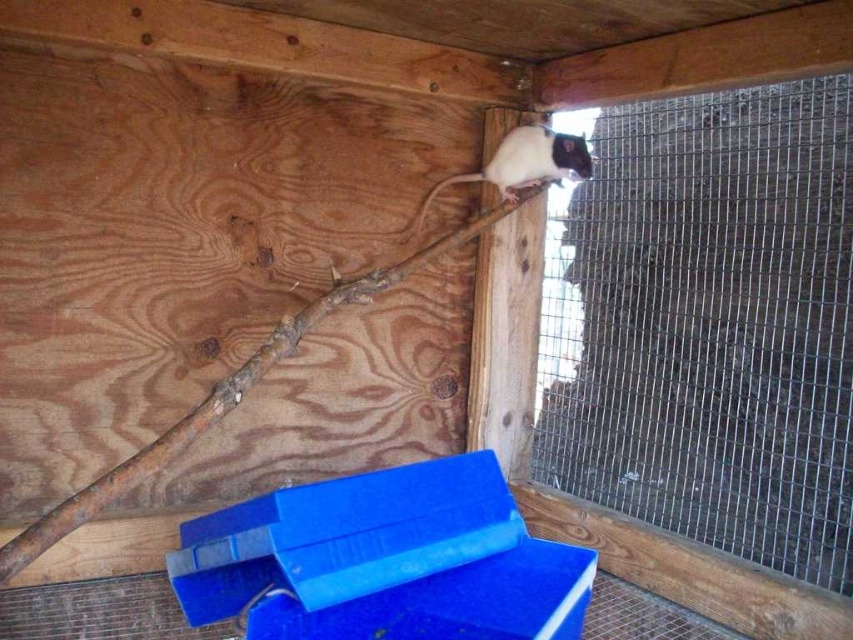
Is blue plastic box at lower center to the left of white fur/black fur rat at upper right from the viewer's perspective?

Correct, you'll find blue plastic box at lower center to the left of white fur/black fur rat at upper right.

Is blue plastic box at lower center bigger than white fur/black fur rat at upper right?

Yes, blue plastic box at lower center is bigger than white fur/black fur rat at upper right.

Is point (357, 600) positioned in front of point (479, 173)?

Yes, point (357, 600) is closer to viewer.

Locate an element on the screen. This screenshot has height=640, width=853. blue plastic box at lower center is located at coordinates (384, 561).